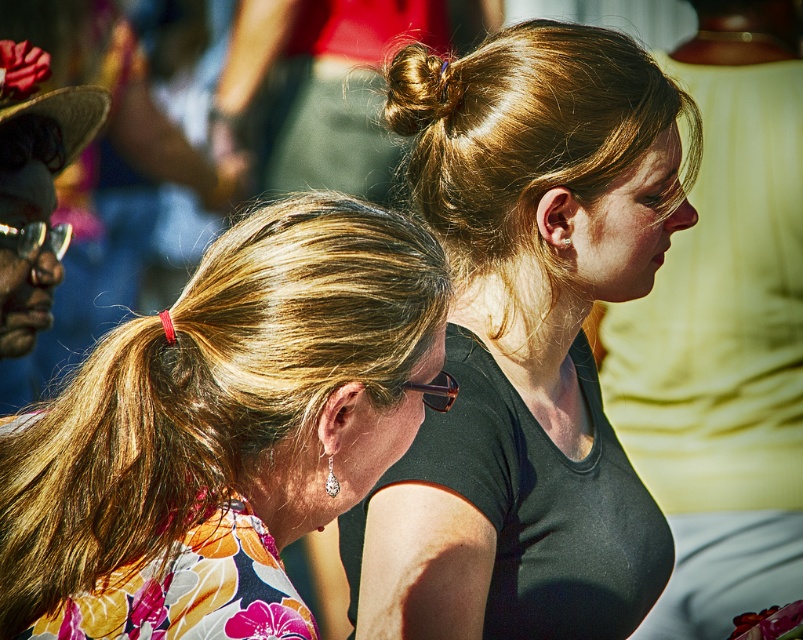
Question: Does black matte shirt at upper center appear on the left side of black matte shirt at center?

Choices:
 (A) yes
 (B) no

Answer: (A)

Question: Which of the following is the closest to the observer?

Choices:
 (A) (553, 490)
 (B) (378, 248)

Answer: (B)

Question: Is black matte shirt at center positioned at the back of golden shiny hair at upper center?

Choices:
 (A) yes
 (B) no

Answer: (A)

Question: Which point is farther from the camera taking this photo?

Choices:
 (A) (759, 545)
 (B) (410, 64)

Answer: (A)

Question: Can you confirm if black matte shirt at center is bigger than golden shiny hair at upper center?

Choices:
 (A) yes
 (B) no

Answer: (A)

Question: Estimate the real-world distances between objects in this image. Which object is closer to the black matte shirt at upper center?

Choices:
 (A) black matte shirt at center
 (B) golden shiny hair at upper center
 (C) blonde hair at center

Answer: (B)